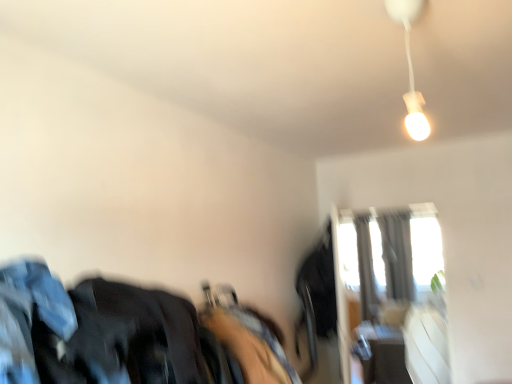
What do you see at coordinates (410, 67) in the screenshot? I see `white matte lamp at upper right` at bounding box center [410, 67].

This screenshot has height=384, width=512. What do you see at coordinates (391, 295) in the screenshot? I see `transparent glass window at upper right` at bounding box center [391, 295].

The width and height of the screenshot is (512, 384). What are the coordinates of `white matte lamp at upper right` in the screenshot? It's located at (410, 67).

Can you confirm if silky gray curtain at upper right is wider than dark blue fabric at left?

In fact, silky gray curtain at upper right might be narrower than dark blue fabric at left.

Is point (398, 270) positioned in front of point (189, 357)?

That is False.

From the picture: From a real-world perspective, relative to dark blue fabric at left, is silky gray curtain at upper right vertically above or below?

Clearly, from a real-world perspective, silky gray curtain at upper right is below dark blue fabric at left.

Can you tell me how much silky gray curtain at upper right and dark blue fabric at left differ in facing direction?

The angle between the facing direction of silky gray curtain at upper right and the facing direction of dark blue fabric at left is 87.2 degrees.

Can you confirm if dark blue fabric at left is thinner than silky gray curtain at upper right?

In fact, dark blue fabric at left might be wider than silky gray curtain at upper right.

Is silky gray curtain at upper right at the back of dark blue fabric at left?

No.

Can you tell me how much dark blue fabric at left and silky gray curtain at upper right differ in facing direction?

87.2 degrees.

Is dark blue fabric at left to the left or to the right of silky gray curtain at upper right in the image?

dark blue fabric at left is to the left of silky gray curtain at upper right.

I want to click on clothing in front of the transparent glass window at upper right, so click(137, 331).

From a real-world perspective, is dark blue fabric at left physically below transparent glass window at upper right?

Actually, dark blue fabric at left is physically above transparent glass window at upper right in the real world.

Are dark blue fabric at left and transparent glass window at upper right far apart?

Yes, dark blue fabric at left and transparent glass window at upper right are quite far apart.

Is transparent glass window at upper right oriented away from white matte lamp at upper right?

No, transparent glass window at upper right is not facing the opposite direction of white matte lamp at upper right.

From the image's perspective, is transparent glass window at upper right located above or below white matte lamp at upper right?

Clearly, from the image's perspective, transparent glass window at upper right is below white matte lamp at upper right.

Based on the photo, which point is more forward, (x=386, y=267) or (x=408, y=126)?

The point (x=408, y=126) is more forward.

Can you confirm if transparent glass window at upper right is bigger than white matte lamp at upper right?

Indeed, transparent glass window at upper right has a larger size compared to white matte lamp at upper right.

This screenshot has height=384, width=512. I want to click on window below the white matte lamp at upper right (from the image's perspective), so click(391, 295).

From a real-world perspective, does white matte lamp at upper right sit lower than transparent glass window at upper right?

No, from a real-world perspective, white matte lamp at upper right is not below transparent glass window at upper right.

From the image's perspective, which object appears higher, white matte lamp at upper right or transparent glass window at upper right?

white matte lamp at upper right.

Can you see white matte lamp at upper right touching dark blue fabric at left?

No, white matte lamp at upper right is not touching dark blue fabric at left.

From the picture: Can you confirm if white matte lamp at upper right is taller than dark blue fabric at left?

Yes, white matte lamp at upper right is taller than dark blue fabric at left.

Based on the photo, is white matte lamp at upper right bigger or smaller than dark blue fabric at left?

white matte lamp at upper right is smaller than dark blue fabric at left.

Find the location of a particular element. clothing in front of the white matte lamp at upper right is located at coordinates pyautogui.click(x=137, y=331).

Considering the relative positions of dark blue fabric at left and white matte lamp at upper right in the image provided, is dark blue fabric at left to the right of white matte lamp at upper right from the viewer's perspective?

No, dark blue fabric at left is not to the right of white matte lamp at upper right.

How many degrees apart are the facing directions of dark blue fabric at left and white matte lamp at upper right?

The angle between the facing direction of dark blue fabric at left and the facing direction of white matte lamp at upper right is 91 degrees.

Considering the relative sizes of dark blue fabric at left and white matte lamp at upper right in the image provided, is dark blue fabric at left wider than white matte lamp at upper right?

Correct, the width of dark blue fabric at left exceeds that of white matte lamp at upper right.

This screenshot has width=512, height=384. In order to click on clothing above the silky gray curtain at upper right (from the image's perspective) in this screenshot , I will do `click(137, 331)`.

Where is `curtain that appears behind the dark blue fabric at left`? curtain that appears behind the dark blue fabric at left is located at coordinates (397, 255).

Looking at the image, which one is located closer to silky gray curtain at upper right, dark blue fabric at left or white matte lamp at upper right?

white matte lamp at upper right lies closer to silky gray curtain at upper right than the other object.

When comparing their distances from silky gray curtain at upper right, does white matte lamp at upper right or transparent glass window at upper right seem further?

→ white matte lamp at upper right is positioned further to the anchor silky gray curtain at upper right.

When comparing their distances from transparent glass window at upper right, does white matte lamp at upper right or silky gray curtain at upper right seem closer?

silky gray curtain at upper right lies closer to transparent glass window at upper right than the other object.

Estimate the real-world distances between objects in this image. Which object is further from white matte lamp at upper right, silky gray curtain at upper right or transparent glass window at upper right?

transparent glass window at upper right.

Which object lies further to the anchor point transparent glass window at upper right, silky gray curtain at upper right or dark blue fabric at left?

The object further to transparent glass window at upper right is dark blue fabric at left.

Considering their positions, is silky gray curtain at upper right positioned closer to dark blue fabric at left than transparent glass window at upper right?

The object closer to dark blue fabric at left is transparent glass window at upper right.

Estimate the real-world distances between objects in this image. Which object is further from white matte lamp at upper right, dark blue fabric at left or silky gray curtain at upper right?

Based on the image, silky gray curtain at upper right appears to be further to white matte lamp at upper right.

When comparing their distances from white matte lamp at upper right, does transparent glass window at upper right or silky gray curtain at upper right seem closer?

silky gray curtain at upper right is positioned closer to the anchor white matte lamp at upper right.

At what (x,y) coordinates should I click in order to perform the action: click on lamp between dark blue fabric at left and transparent glass window at upper right from front to back. Please return your answer as a coordinate pair (x, y). Looking at the image, I should click on (410, 67).

Find the location of a particular element. The height and width of the screenshot is (384, 512). window between dark blue fabric at left and silky gray curtain at upper right from front to back is located at coordinates (391, 295).

I want to click on window between white matte lamp at upper right and silky gray curtain at upper right in the front-back direction, so click(391, 295).

Locate an element on the screen. lamp positioned between dark blue fabric at left and silky gray curtain at upper right from near to far is located at coordinates (410, 67).